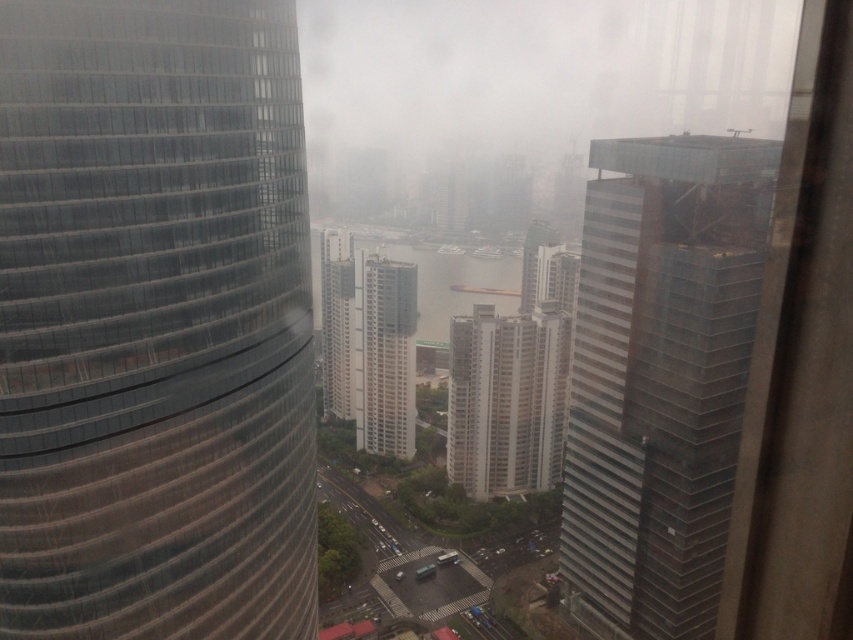
You are standing at the observation deck of the transparent glass tower at left and want to take a photo of the transparent glass skyscraper at right. Which object should you focus on first to ensure both are in the frame?

You should focus on the transparent glass tower at left first because it is closer to you than the transparent glass skyscraper at right, so adjusting focus starting from the closer object ensures both are in the frame.

You are standing at the center of the city and want to locate the white textured building at center. According to the coordinates provided, where would you find it?

The white textured building at center is located at point (x=386, y=356), which means it is positioned slightly to the right and above the center point of the image.